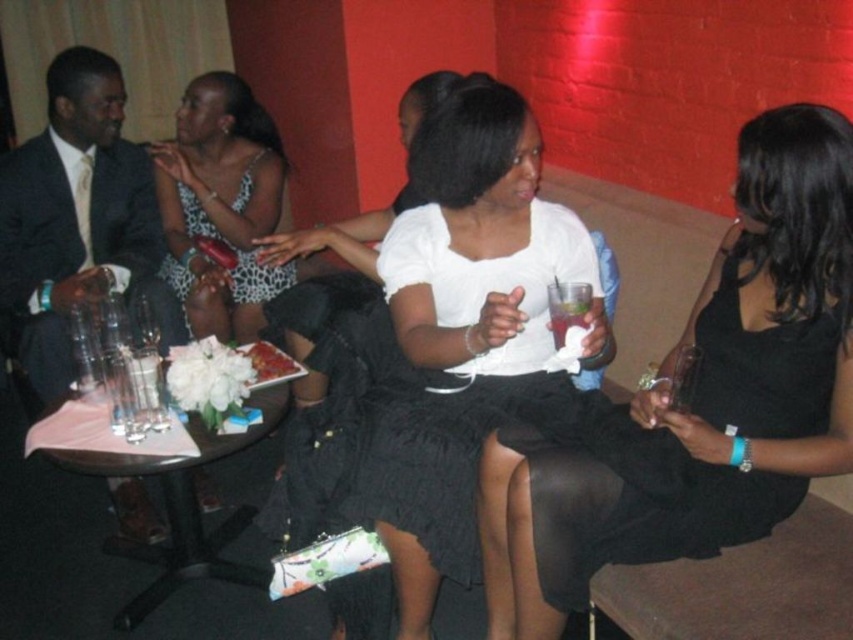
Question: Which of the following is the closest to the observer?

Choices:
 (A) (94, 460)
 (B) (566, 301)

Answer: (B)

Question: Is wooden round table at lower left positioned in front of clear plastic cup at center?

Choices:
 (A) yes
 (B) no

Answer: (B)

Question: Which object is positioned closest to the white matte dress at center?

Choices:
 (A) matte black suit at left
 (B) matte white blouse at center
 (C) wooden round table at lower left
 (D) clear plastic cup at center

Answer: (B)

Question: Can you confirm if white matte dress at center is thinner than wooden round table at lower left?

Choices:
 (A) yes
 (B) no

Answer: (A)

Question: Among these points, which one is farthest from the camera?

Choices:
 (A) [x=117, y=72]
 (B) [x=178, y=576]
 (C) [x=706, y=284]

Answer: (A)

Question: Is matte white blouse at center closer to the viewer compared to white matte dress at center?

Choices:
 (A) no
 (B) yes

Answer: (B)